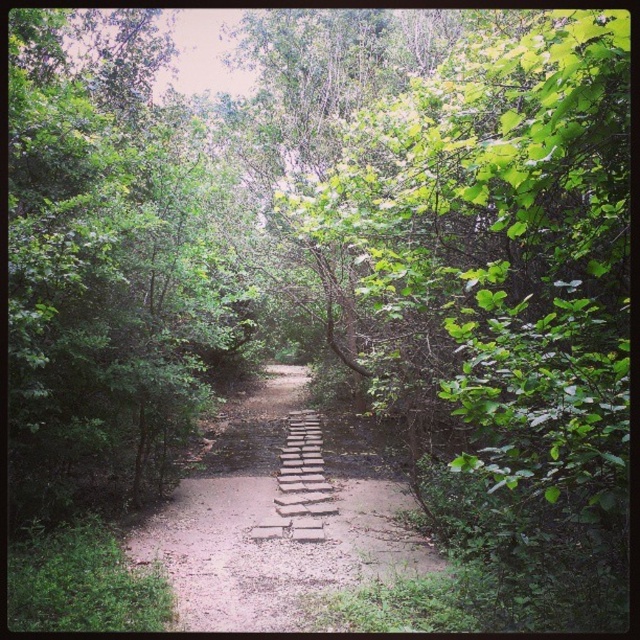
Is brick-like stone steps at center bigger than brown stone stairs at center?

Correct, brick-like stone steps at center is larger in size than brown stone stairs at center.

This screenshot has height=640, width=640. Identify the location of brick-like stone steps at center. (275, 524).

Between point (289, 380) and point (323, 529), which one is positioned in front?

Point (323, 529)

I want to click on brick-like stone steps at center, so click(x=275, y=524).